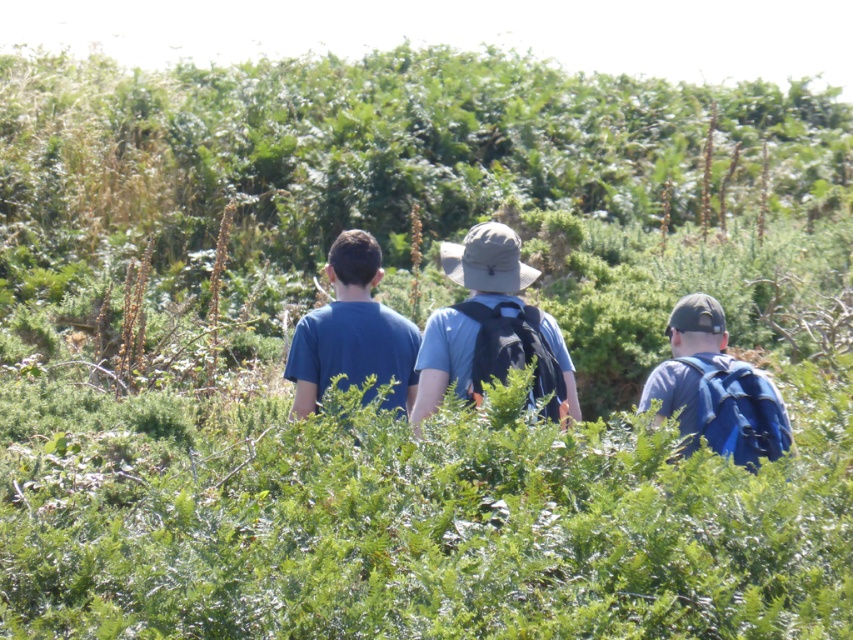
Question: Considering the relative positions of blue fabric backpack at right and blue matte shirt at center in the image provided, where is blue fabric backpack at right located with respect to blue matte shirt at center?

Choices:
 (A) right
 (B) left

Answer: (A)

Question: Which object is the farthest from the blue fabric backpack at right?

Choices:
 (A) blue matte shirt at center
 (B) matte blue shirt at center

Answer: (A)

Question: In this image, where is matte blue shirt at center located relative to blue fabric backpack at right?

Choices:
 (A) below
 (B) above

Answer: (B)

Question: Does blue fabric backpack at right have a lesser width compared to blue matte shirt at center?

Choices:
 (A) yes
 (B) no

Answer: (B)

Question: Which point is farther to the camera?

Choices:
 (A) (369, 388)
 (B) (508, 337)

Answer: (B)

Question: Among these points, which one is farthest from the camera?

Choices:
 (A) (509, 285)
 (B) (363, 364)
 (C) (720, 324)

Answer: (C)